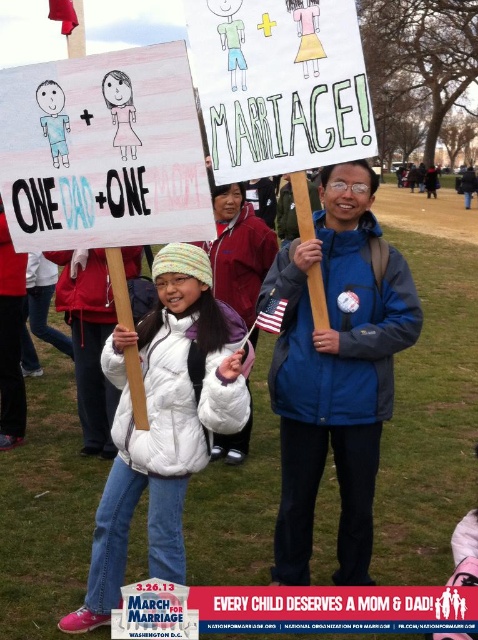
Which is more to the left, blue fabric jacket at center or white puffy coat at center?

white puffy coat at center

Does blue fabric jacket at center appear on the right side of white puffy coat at center?

Yes, blue fabric jacket at center is to the right of white puffy coat at center.

Between point (279, 353) and point (101, 516), which one is positioned in front?

Point (101, 516) is in front.

Identify the location of blue fabric jacket at center. This screenshot has width=478, height=640. (336, 371).